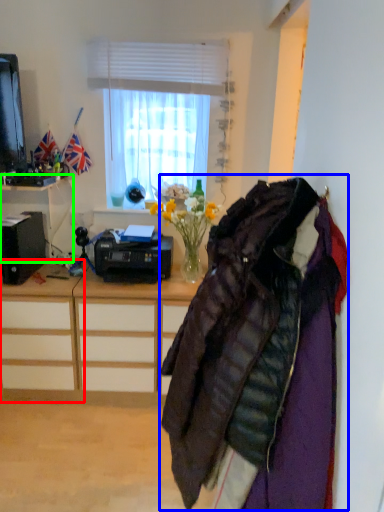
Question: Estimate the real-world distances between objects in this image. Which object is closer to desk (highlighted by a red box), jacket (highlighted by a blue box) or desk (highlighted by a green box)?

Choices:
 (A) jacket
 (B) desk

Answer: (B)